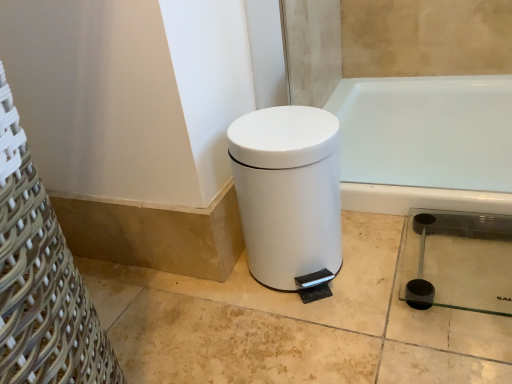
At what (x,y) coordinates should I click in order to perform the action: click on free space to the right of white matte waste container at lower center. Please return your answer as a coordinate pair (x, y). Looking at the image, I should click on (380, 254).